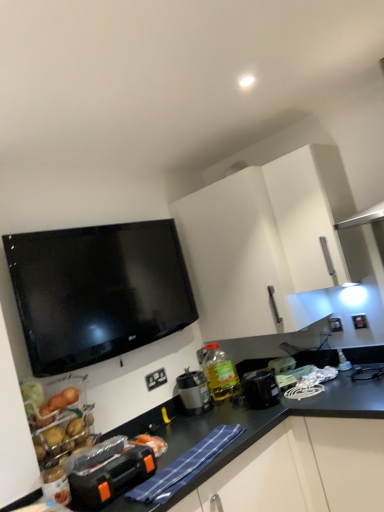
This screenshot has width=384, height=512. I want to click on vacant area on top of black plastic container at lower right, which is counted as the third appliance, starting from the left (from a real-world perspective), so click(x=257, y=374).